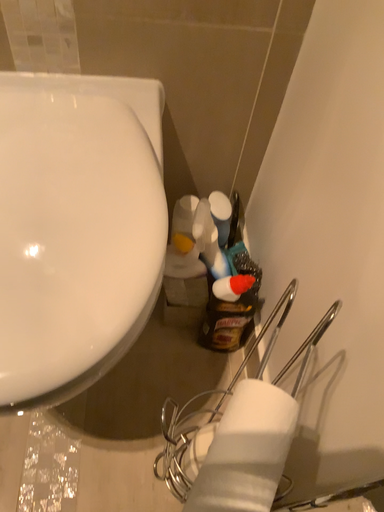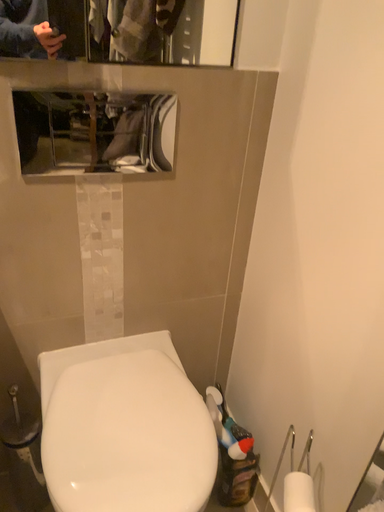
Question: Which way did the camera rotate in the video?

Choices:
 (A) rotated upward
 (B) rotated downward

Answer: (A)